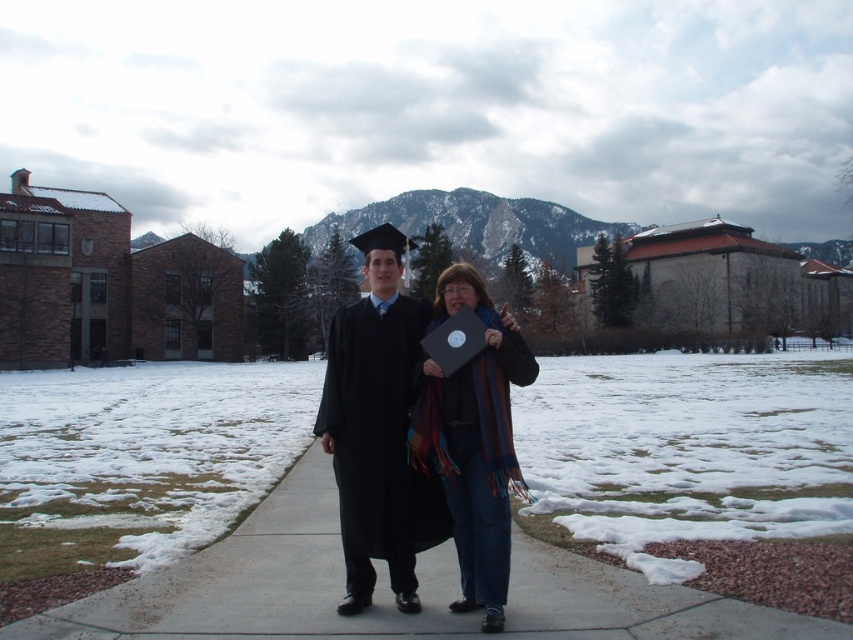
You are a photographer taking a photo of the two people in the scene. You want to focus on the blue striped scarf at center without the black matte graduation gown at center blocking it. Is this possible?

The black matte graduation gown at center is further to the viewer than the blue striped scarf at center, so it will block the scarf. You need to move the gown or the scarf to avoid the obstruction.

You are a photographer taking a photo of the two people in the scene. You want to ensure both the black matte graduation gown at center and the blue striped scarf at center are clearly visible in the frame. Which object should you focus on to ensure it doesn t get cropped out?

The blue striped scarf at center is taller than the black matte graduation gown at center, so focusing on the taller blue striped scarf at center will ensure it stays in frame and the shorter black matte graduation gown at center will also be visible.